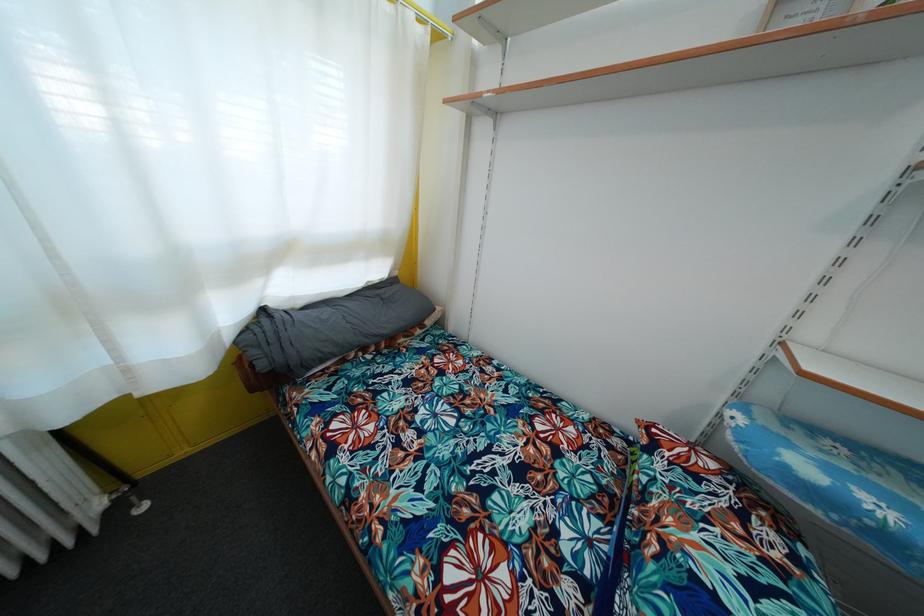
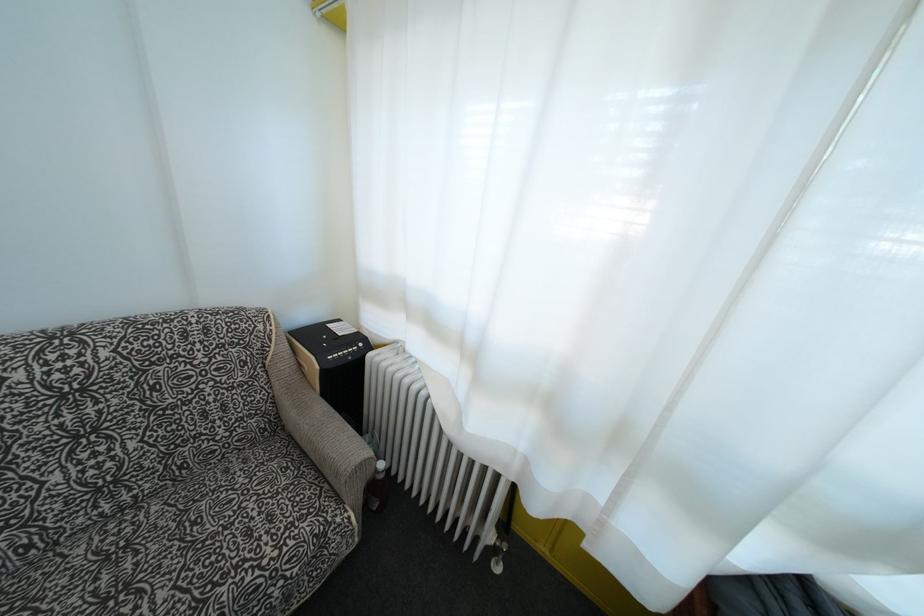
Question: The first image is from the beginning of the video and the second image is from the end. How did the camera likely rotate when shooting the video?

Choices:
 (A) Left
 (B) Right
 (C) Up
 (D) Down

Answer: (A)